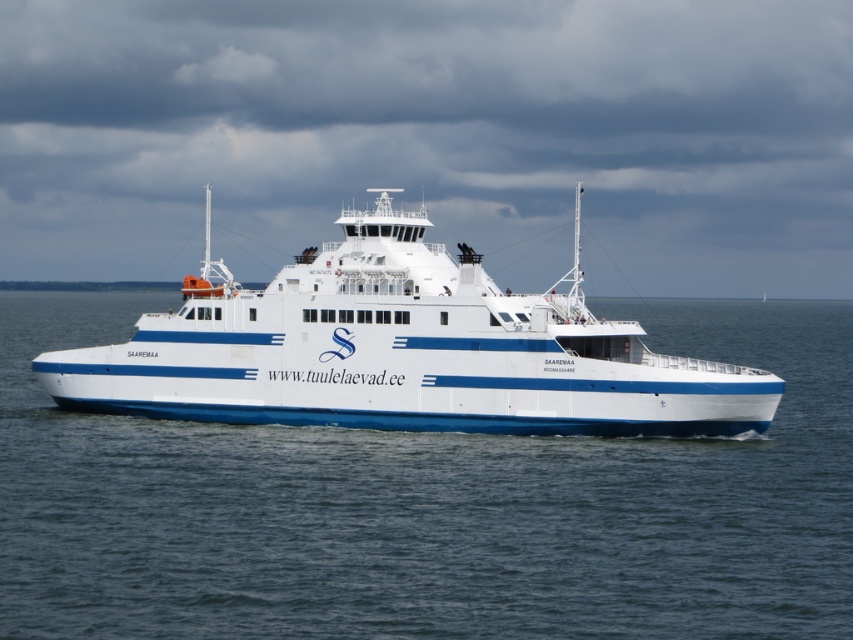
Is blue water at center wider than white matte ferry at center?

Yes.

Does blue water at center appear over white matte ferry at center?

No.

Find the location of `blue water at center`. blue water at center is located at coordinates (428, 506).